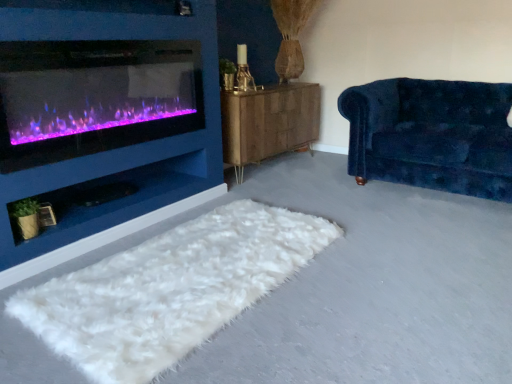
Question: Is purple glass wood burning stove at left bigger or smaller than woodenmaterial/texturedresser at center?

Choices:
 (A) big
 (B) small

Answer: (B)

Question: Is purple glass wood burning stove at left taller or shorter than woodenmaterial/texturedresser at center?

Choices:
 (A) short
 (B) tall

Answer: (A)

Question: Estimate the real-world distances between objects in this image. Which object is closer to the velvet blue couch at right?

Choices:
 (A) purple glass wood burning stove at left
 (B) woodenmaterial/texturedresser at center
 (C) white fluffy rug at lower center

Answer: (B)

Question: Which object is positioned closest to the white fluffy rug at lower center?

Choices:
 (A) woodenmaterial/texturedresser at center
 (B) velvet blue couch at right
 (C) purple glass wood burning stove at left

Answer: (C)